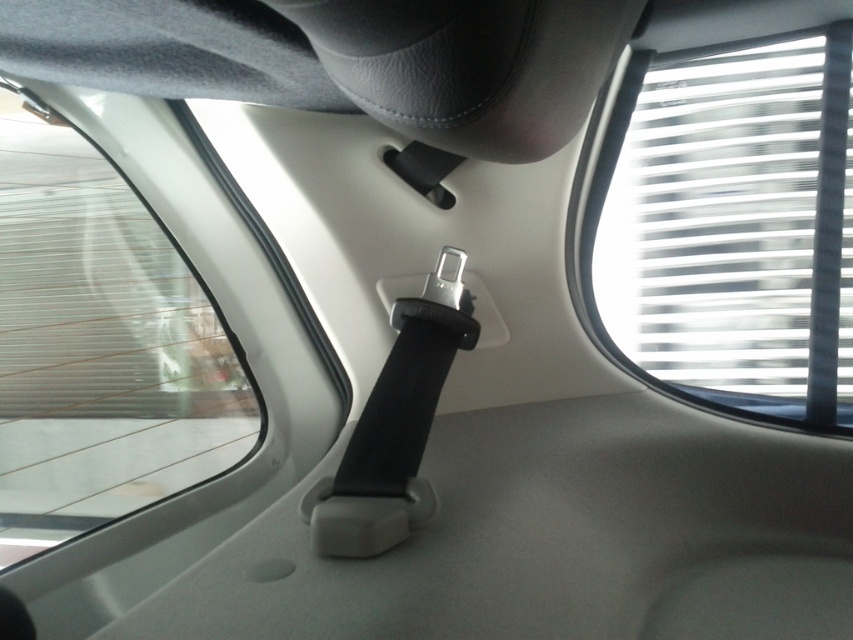
Identify the location of white translucent blinds at upper right. (730, 225).

Does white translucent blinds at upper right have a smaller size compared to transparent glass window at center?

Yes, white translucent blinds at upper right is smaller than transparent glass window at center.

Between point (769, 129) and point (106, 352), which one is positioned in front?

Positioned in front is point (769, 129).

Image resolution: width=853 pixels, height=640 pixels. Find the location of `white translucent blinds at upper right`. white translucent blinds at upper right is located at coordinates (730, 225).